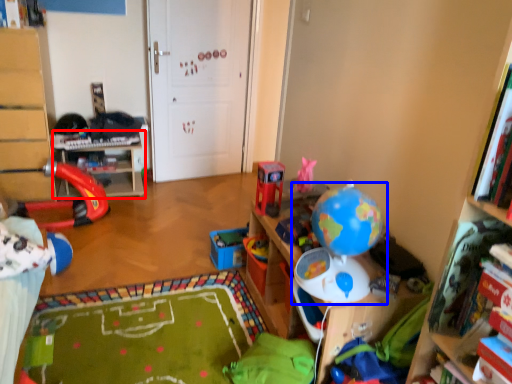
Question: Among these objects, which one is nearest to the camera, table (highlighted by a red box) or toy (highlighted by a blue box)?

Choices:
 (A) table
 (B) toy

Answer: (B)